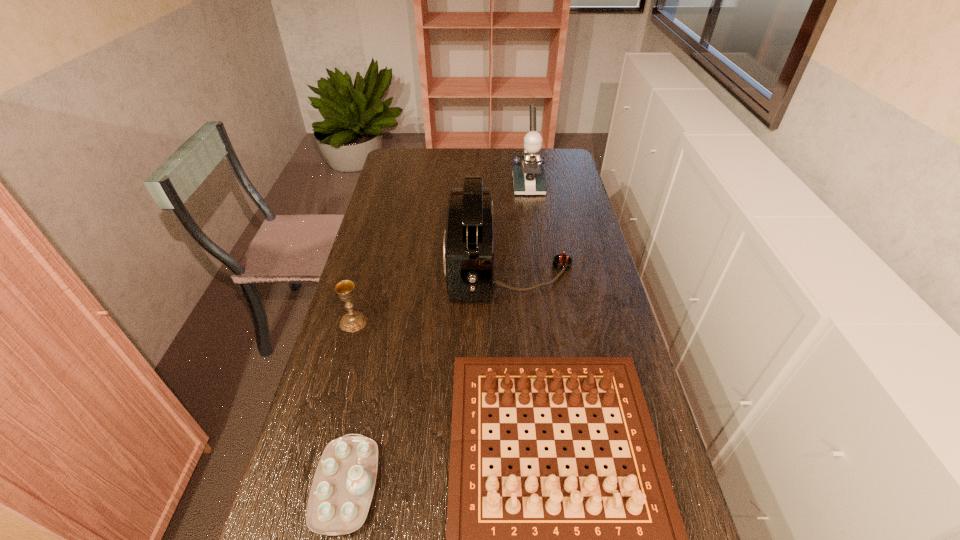
At what (x,y) coordinates should I click in order to perform the action: click on free space located 0.270m on the right of the shortest object. Please return your answer as a coordinate pair (x, y). Image resolution: width=960 pixels, height=540 pixels. Looking at the image, I should click on (506, 486).

Where is `object that is at the far edge`? object that is at the far edge is located at coordinates (528, 177).

The width and height of the screenshot is (960, 540). I want to click on chalice that is at the left edge, so click(x=353, y=321).

Image resolution: width=960 pixels, height=540 pixels. I want to click on chinaware located in the left edge section of the desktop, so click(341, 493).

Identify the location of microscope that is positioned at the right edge. [x=528, y=177].

You are a GUI agent. You are given a task and a screenshot of the screen. Output one action in this format:
    pyautogui.click(x=<x>, y=<y>)
    Task: Click on the radio receiver that is positioned at the right edge
    This screenshot has height=540, width=960.
    Given the screenshot: What is the action you would take?
    pyautogui.click(x=468, y=245)

Identify the location of object that is at the far right corner. The width and height of the screenshot is (960, 540). (528, 177).

Image resolution: width=960 pixels, height=540 pixels. In order to click on vacant space at the far edge in this screenshot , I will do `click(506, 172)`.

Identify the location of vacant area at the left edge. [362, 281].

Identify the location of vacant space at the right edge of the desktop. (573, 177).